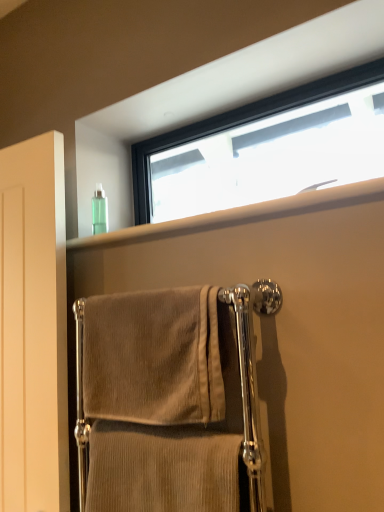
Question: Is beige corduroy towel at center, marked as the 1th towel in a top-to-bottom arrangement, situated inside matte white door at left or outside?

Choices:
 (A) inside
 (B) outside

Answer: (B)

Question: Is beige corduroy towel at center, marked as the 1th towel in a top-to-bottom arrangement, wider or thinner than matte white door at left?

Choices:
 (A) wide
 (B) thin

Answer: (A)

Question: Which is farther from the beige corduroy towel at center, the second towel from the top?

Choices:
 (A) beige corduroy towel at center, marked as the 1th towel in a top-to-bottom arrangement
 (B) clear plastic bottle at upper center
 (C) matte white door at left
 (D) green translucent bottle at upper left
 (E) black frame window at upper center

Answer: (E)

Question: Based on their relative distances, which object is farther from the black frame window at upper center?

Choices:
 (A) green translucent bottle at upper left
 (B) matte white door at left
 (C) beige corduroy towel at center, the first towel when ordered from bottom to top
 (D) beige corduroy towel at center, marked as the 1th towel in a top-to-bottom arrangement
 (E) clear plastic bottle at upper center

Answer: (C)